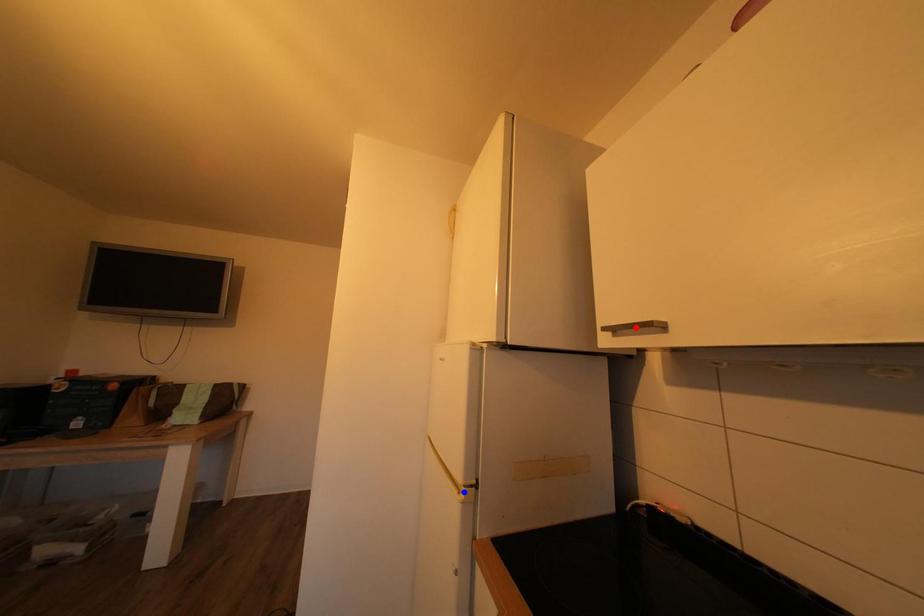
Question: In the image, two points are highlighted. Which point is nearer to the camera? Reply with the corresponding letter.

Choices:
 (A) blue point
 (B) red point

Answer: (B)